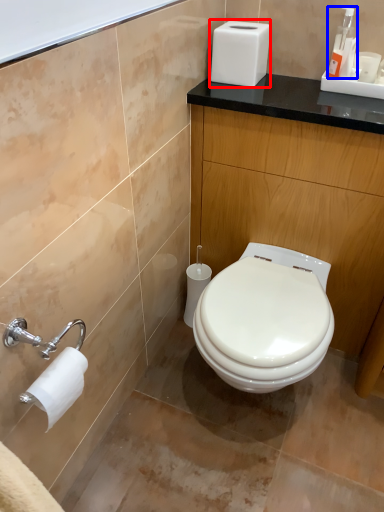
Question: Which point is closer to the camera, appliance (highlighted by a red box) or soap dispenser (highlighted by a blue box)?

Choices:
 (A) appliance
 (B) soap dispenser

Answer: (B)